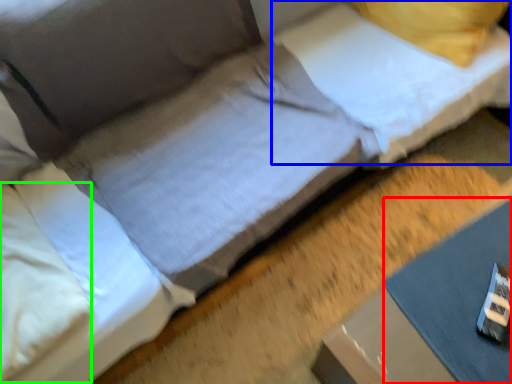
Question: Which object is positioned closest to sheet (highlighted by a red box)? Select from pillow (highlighted by a blue box) and pillow (highlighted by a green box).

Choices:
 (A) pillow
 (B) pillow

Answer: (A)